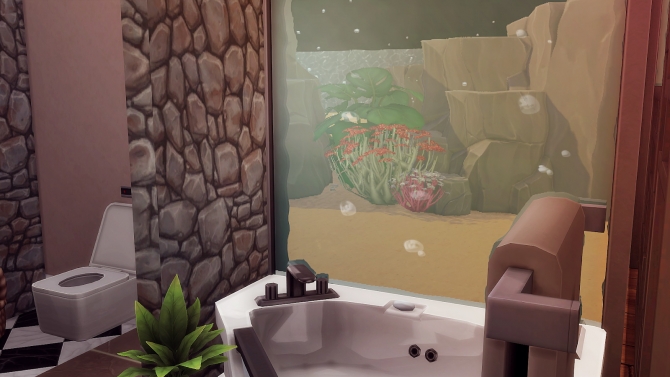
The height and width of the screenshot is (377, 670). What are the coordinates of `white square toilet` in the screenshot? It's located at (80, 303).